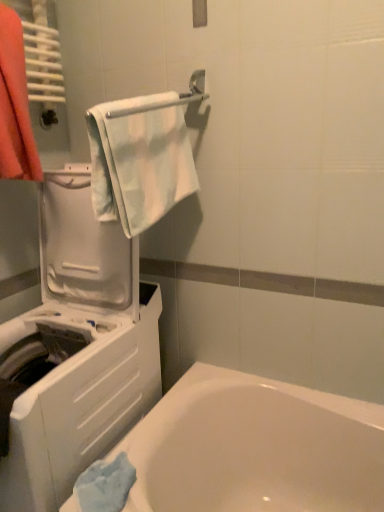
Image resolution: width=384 pixels, height=512 pixels. In order to click on vacant space in white glossy towel bar at upper center (from a real-world perspective) in this screenshot , I will do `click(173, 398)`.